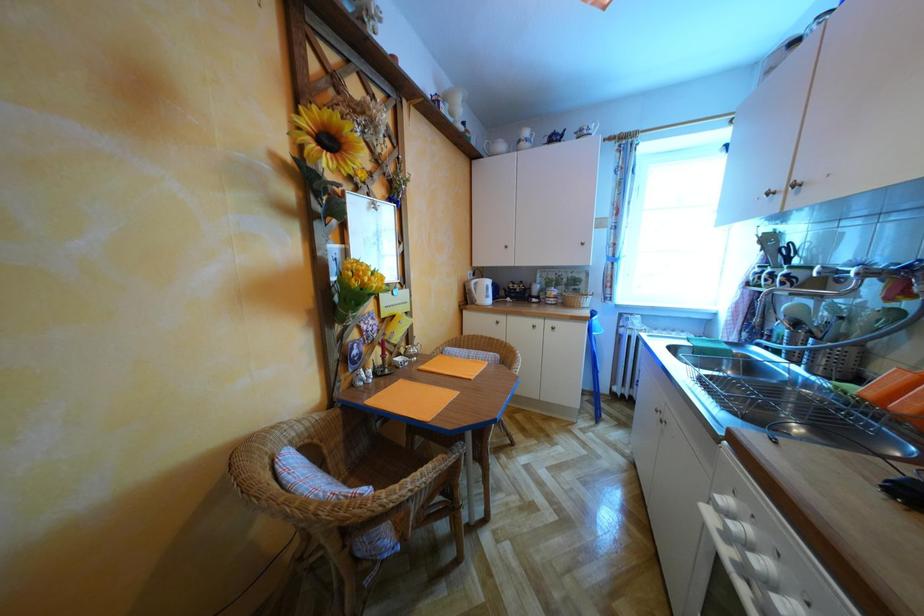
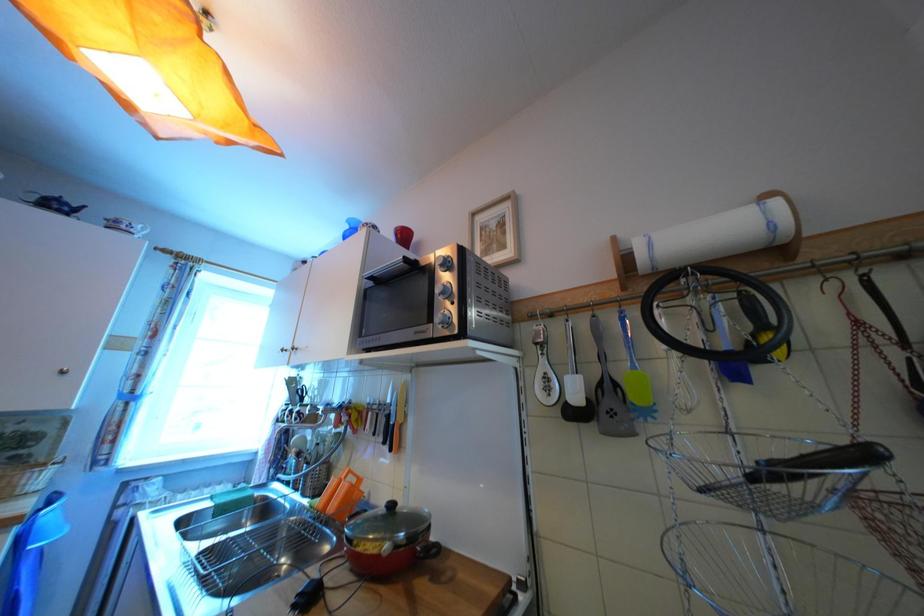
How did the camera likely rotate?

The camera's rotation is toward right-up.